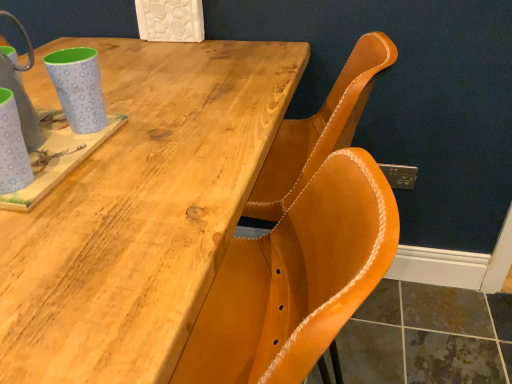
Question: Can you confirm if natural wood table at upper left is thinner than light blue polka dot mug at upper left, placed as the first mug when sorted from back to front?

Choices:
 (A) yes
 (B) no

Answer: (B)

Question: Considering the relative sizes of natural wood table at upper left and light blue polka dot mug at upper left, which ranks as the 2th mug in front-to-back order, in the image provided, is natural wood table at upper left smaller than light blue polka dot mug at upper left, which ranks as the 2th mug in front-to-back order,?

Choices:
 (A) no
 (B) yes

Answer: (A)

Question: From a real-world perspective, is natural wood table at upper left located higher than light blue polka dot mug at upper left, which ranks as the 2th mug in front-to-back order?

Choices:
 (A) no
 (B) yes

Answer: (A)

Question: Does natural wood table at upper left have a larger size compared to light blue polka dot mug at upper left, which ranks as the 2th mug in front-to-back order?

Choices:
 (A) yes
 (B) no

Answer: (A)

Question: Does natural wood table at upper left have a lesser height compared to light blue polka dot mug at upper left, which ranks as the 2th mug in front-to-back order?

Choices:
 (A) no
 (B) yes

Answer: (A)

Question: Considering the positions of light blue polka dot mug at upper left, which ranks as the 2th mug in front-to-back order, and matte blue cup at left, acting as the 1th mug starting from the front, in the image, is light blue polka dot mug at upper left, which ranks as the 2th mug in front-to-back order, taller or shorter than matte blue cup at left, acting as the 1th mug starting from the front,?

Choices:
 (A) short
 (B) tall

Answer: (A)

Question: From the image's perspective, is light blue polka dot mug at upper left, which ranks as the 2th mug in front-to-back order, positioned above or below matte blue cup at left, acting as the 1th mug starting from the front?

Choices:
 (A) below
 (B) above

Answer: (B)

Question: In the image, is light blue polka dot mug at upper left, placed as the first mug when sorted from back to front, on the left side or the right side of matte blue cup at left, acting as the 1th mug starting from the front?

Choices:
 (A) right
 (B) left

Answer: (A)

Question: Is light blue polka dot mug at upper left, placed as the first mug when sorted from back to front, inside or outside of matte blue cup at left, which is the 2th mug from back to front?

Choices:
 (A) inside
 (B) outside

Answer: (B)

Question: Considering the positions of matte blue cup at left, acting as the 1th mug starting from the front, and light blue polka dot mug at upper left, which ranks as the 2th mug in front-to-back order, in the image, is matte blue cup at left, acting as the 1th mug starting from the front, wider or thinner than light blue polka dot mug at upper left, which ranks as the 2th mug in front-to-back order,?

Choices:
 (A) wide
 (B) thin

Answer: (B)

Question: Is matte blue cup at left, which is the 2th mug from back to front, to the left or to the right of light blue polka dot mug at upper left, placed as the first mug when sorted from back to front, in the image?

Choices:
 (A) left
 (B) right

Answer: (A)

Question: From a real-world perspective, is matte blue cup at left, acting as the 1th mug starting from the front, above or below light blue polka dot mug at upper left, which ranks as the 2th mug in front-to-back order?

Choices:
 (A) below
 (B) above

Answer: (A)

Question: From the image's perspective, is matte blue cup at left, acting as the 1th mug starting from the front, positioned above or below light blue polka dot mug at upper left, which ranks as the 2th mug in front-to-back order?

Choices:
 (A) above
 (B) below

Answer: (B)

Question: From the image's perspective, is light blue polka dot mug at upper left, placed as the first mug when sorted from back to front, positioned above or below natural wood table at upper left?

Choices:
 (A) below
 (B) above

Answer: (B)

Question: In terms of height, does light blue polka dot mug at upper left, placed as the first mug when sorted from back to front, look taller or shorter compared to natural wood table at upper left?

Choices:
 (A) tall
 (B) short

Answer: (B)